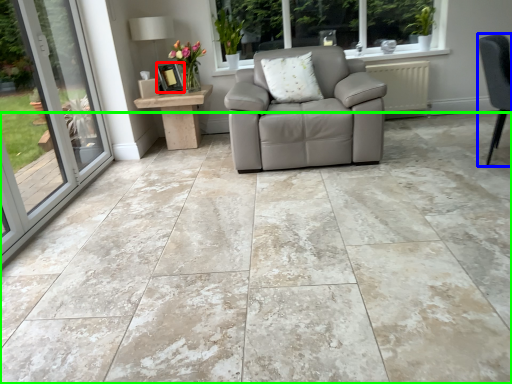
Question: Which object is positioned farthest from picture frame (highlighted by a red box)? Select from chair (highlighted by a blue box) and concrete (highlighted by a green box).

Choices:
 (A) chair
 (B) concrete

Answer: (A)